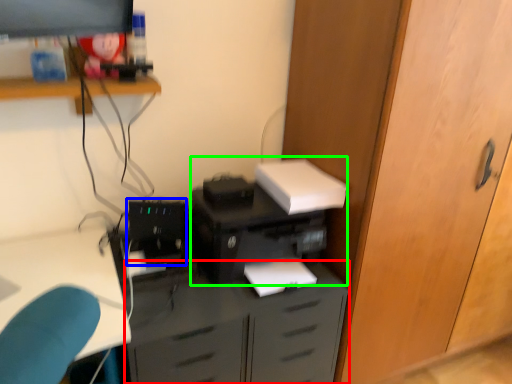
Question: Estimate the real-world distances between objects in this image. Which object is closer to cabinetry (highlighted by a red box), computer tower (highlighted by a blue box) or printer (highlighted by a green box)?

Choices:
 (A) computer tower
 (B) printer

Answer: (B)